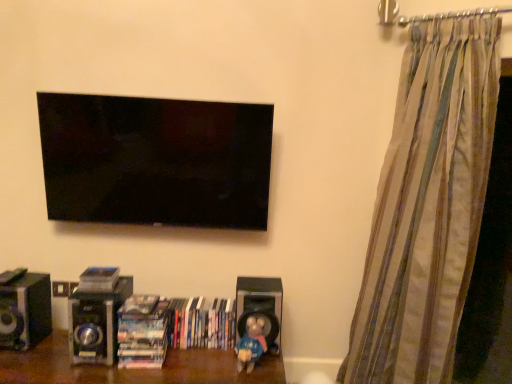
You are a GUI agent. You are given a task and a screenshot of the screen. Output one action in this format:
    pyautogui.click(x=<x>, y=<y>)
    Task: Click on the vacant region above metallic silver speaker at lower left, which ranks as the second speaker in right-to-left order (from a real-world perspective)
    The width and height of the screenshot is (512, 384).
    Given the screenshot: What is the action you would take?
    pyautogui.click(x=95, y=287)